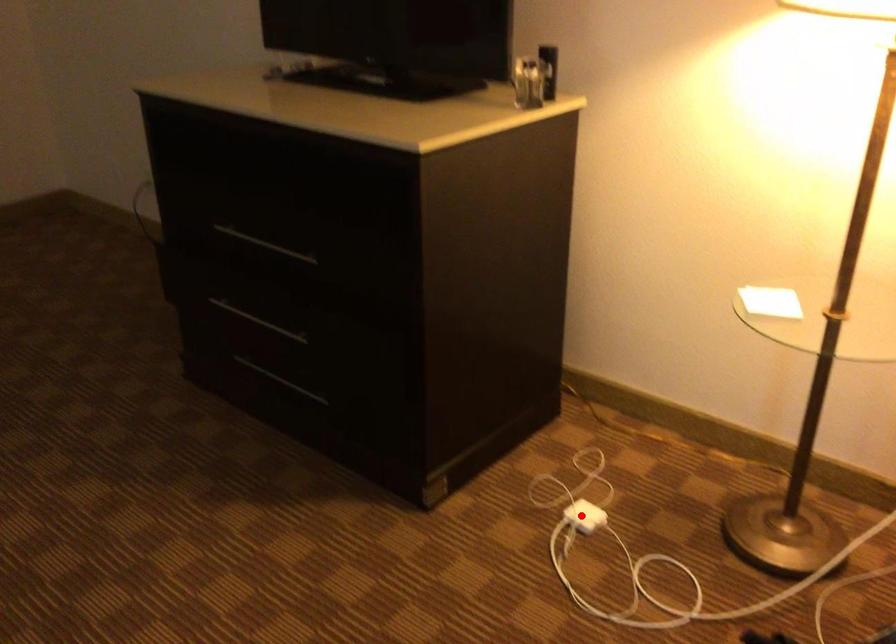
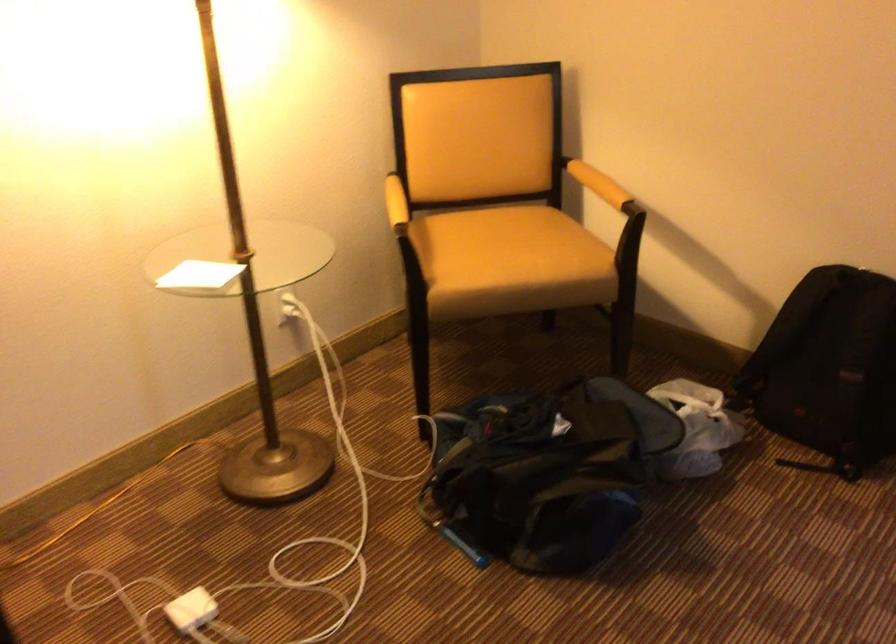
In the second image, find the point that corresponds to the highlighted location in the first image.

(192, 609)